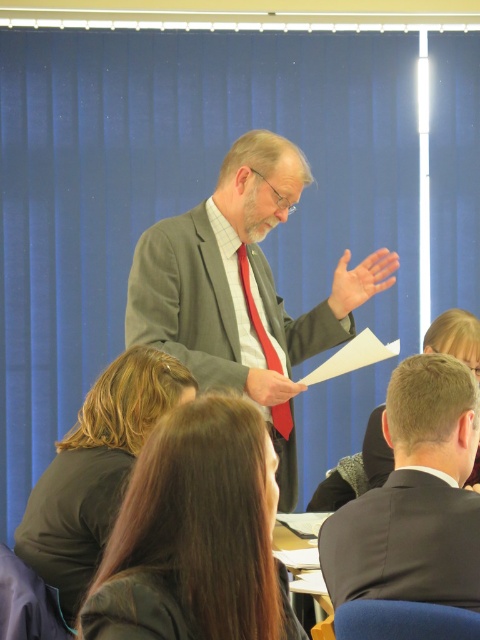
Looking at this image, in the scene, there are two suits at the center of the image. The speaker is wearing one of them. Which suit is taller, the matte gray suit at center or the dark gray suit at center?

The matte gray suit at center is taller than the dark gray suit at center according to the description.

In the image, there is a man giving a presentation. His brown hair is marked by the point at coordinates (195, 536). If you were standing in front of the desk closest to him, would you be able to see his brown hair at center?

The brown hair at center is represented by point (195, 536). Since you are standing in front of the desk closest to him, you would have a clear line of sight to his brown hair at center, so yes, you can see it.

You are sitting in the audience and want to determine which point is closer to you. The points are labeled as point (x=323, y=314) and point (x=423, y=531). Which one is closer?

Point (x=323, y=314) is closer to you because it is further to the viewer than point (x=423, y=531).